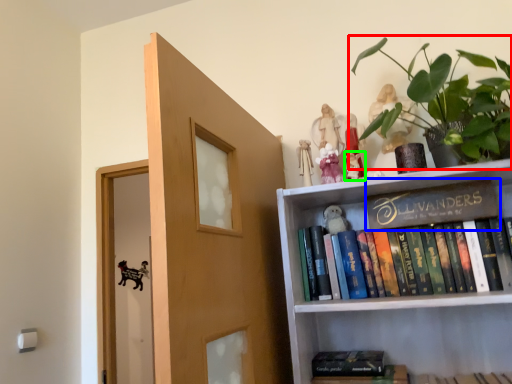
Question: Considering the real-world distances, which object is closest to houseplant (highlighted by a red box)? book (highlighted by a blue box) or toy (highlighted by a green box).

Choices:
 (A) book
 (B) toy

Answer: (A)